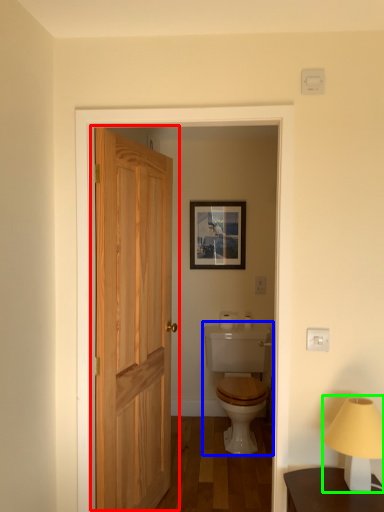
Question: Which object is the farthest from door (highlighted by a red box)? Choose among these: sink (highlighted by a blue box) or table lamp (highlighted by a green box).

Choices:
 (A) sink
 (B) table lamp

Answer: (B)